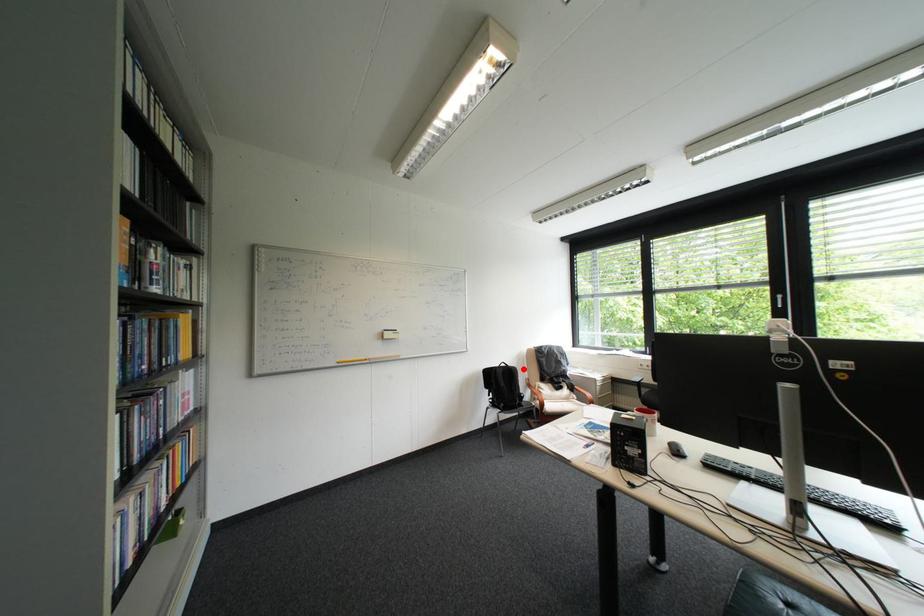
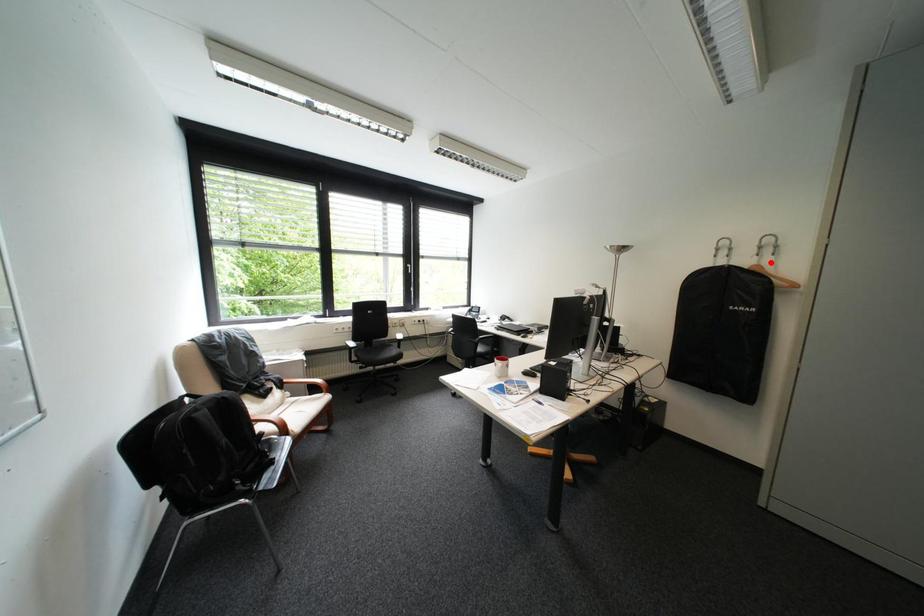
I am providing you with two images of the same scene from different viewpoints. A red point is marked on the first image and another point is marked on the second image. Do the highlighted points in image1 and image2 indicate the same real-world spot?

No